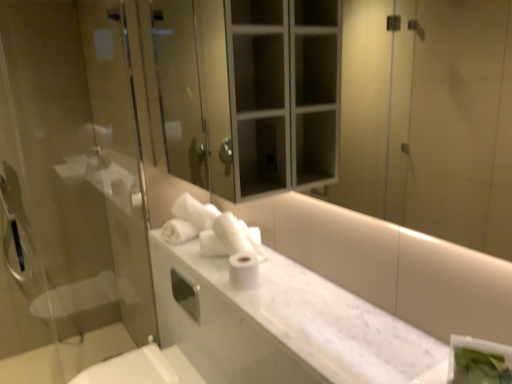
Image resolution: width=512 pixels, height=384 pixels. In order to click on vacant area that is situated to the right of white matte toilet paper at center in this screenshot , I will do `click(282, 281)`.